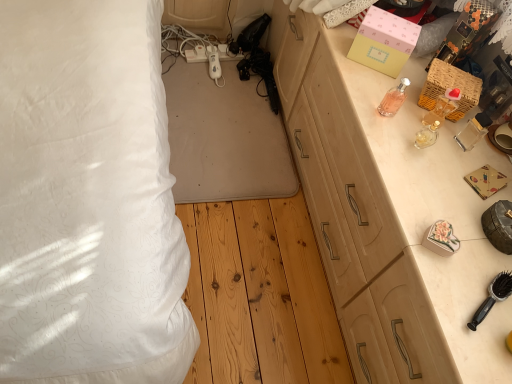
Where is `vacant area that is situated to the right of woven wicker basket at upper right, the first box from the right`? Image resolution: width=512 pixels, height=384 pixels. vacant area that is situated to the right of woven wicker basket at upper right, the first box from the right is located at coordinates (483, 124).